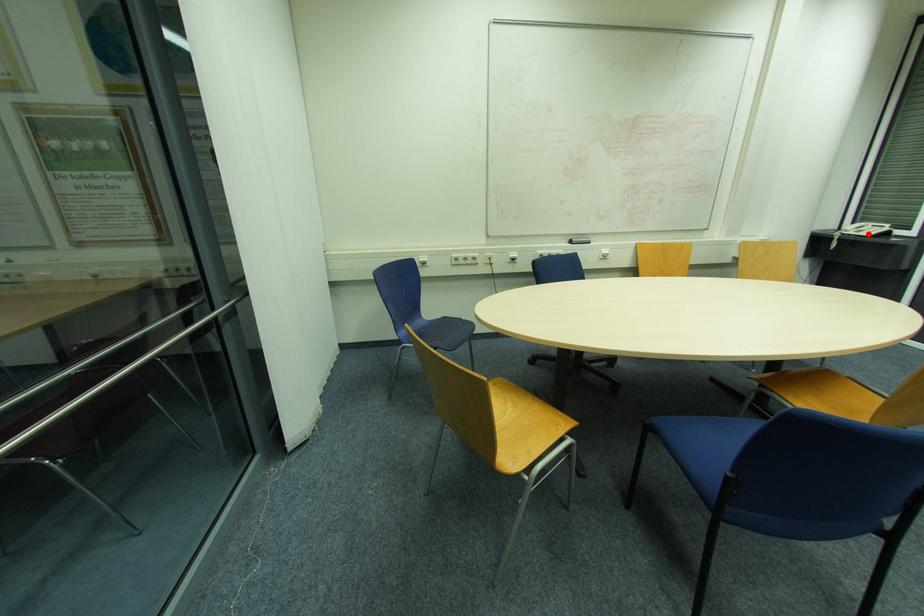
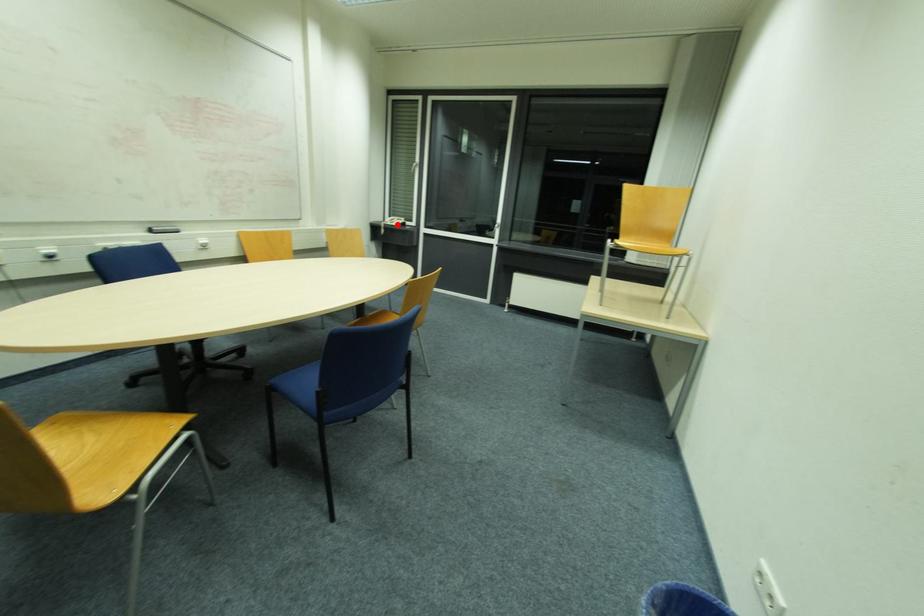
I am providing you with two images of the same scene from different viewpoints. A red point is marked on the first image and another point is marked on the second image. Do the highlighted points in image1 and image2 indicate the same real-world spot?

Yes